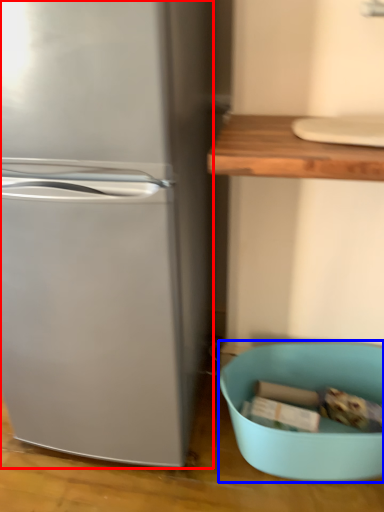
Question: Which of the following is the farthest to the observer, refrigerator (highlighted by a red box) or mixing bowl (highlighted by a blue box)?

Choices:
 (A) refrigerator
 (B) mixing bowl

Answer: (B)